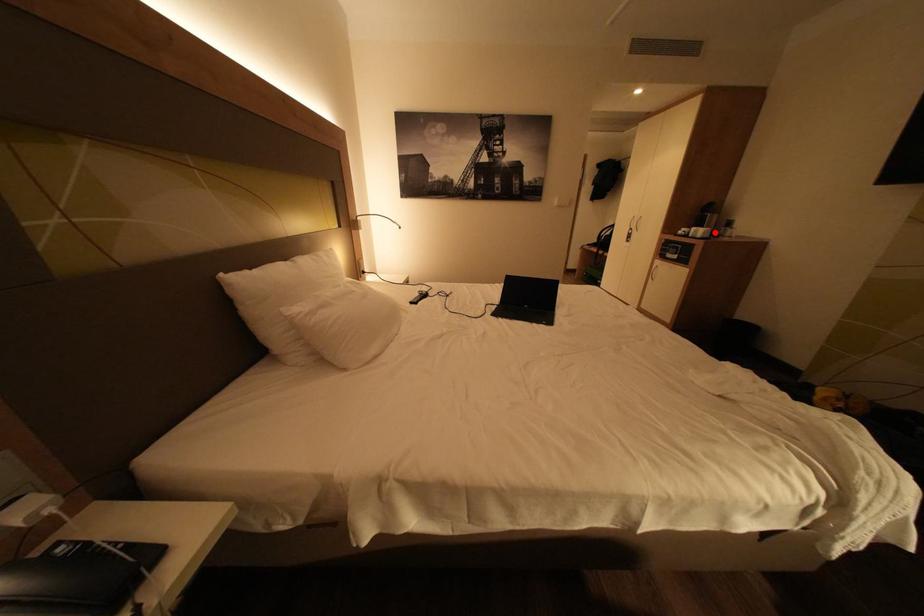
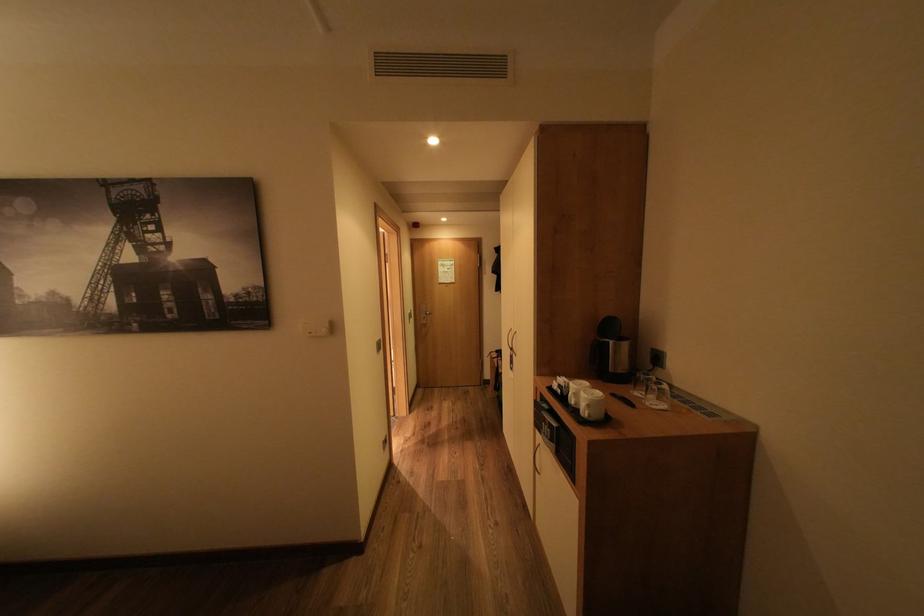
Locate, in the second image, the point that corresponds to the highlighted location in the first image.

(600, 406)